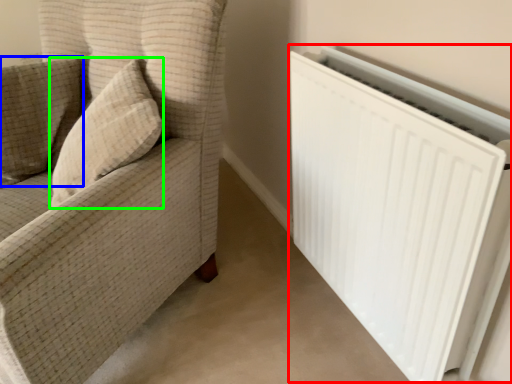
Question: Estimate the real-world distances between objects in this image. Which object is farther from radiator (highlighted by a red box), pillow (highlighted by a blue box) or throw pillow (highlighted by a green box)?

Choices:
 (A) pillow
 (B) throw pillow

Answer: (A)